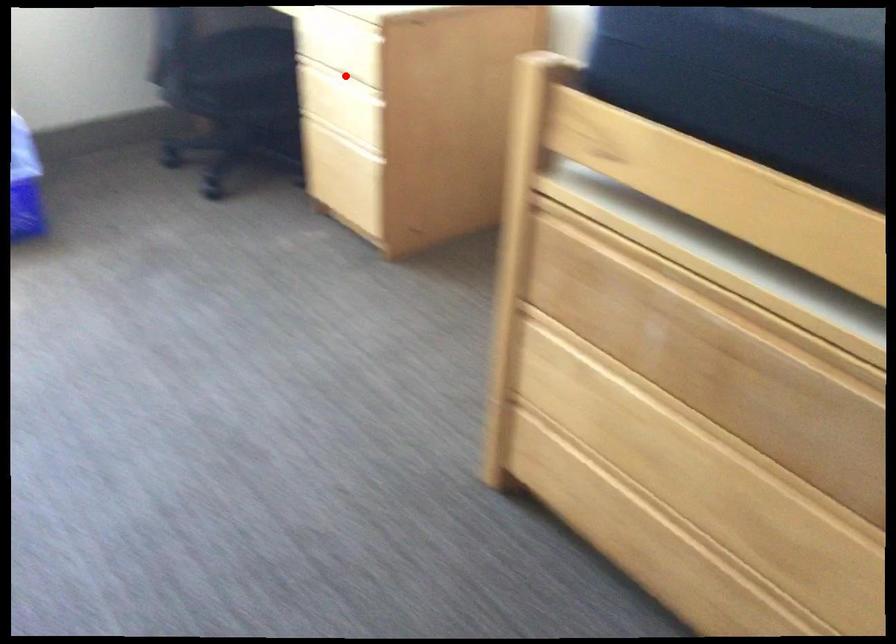
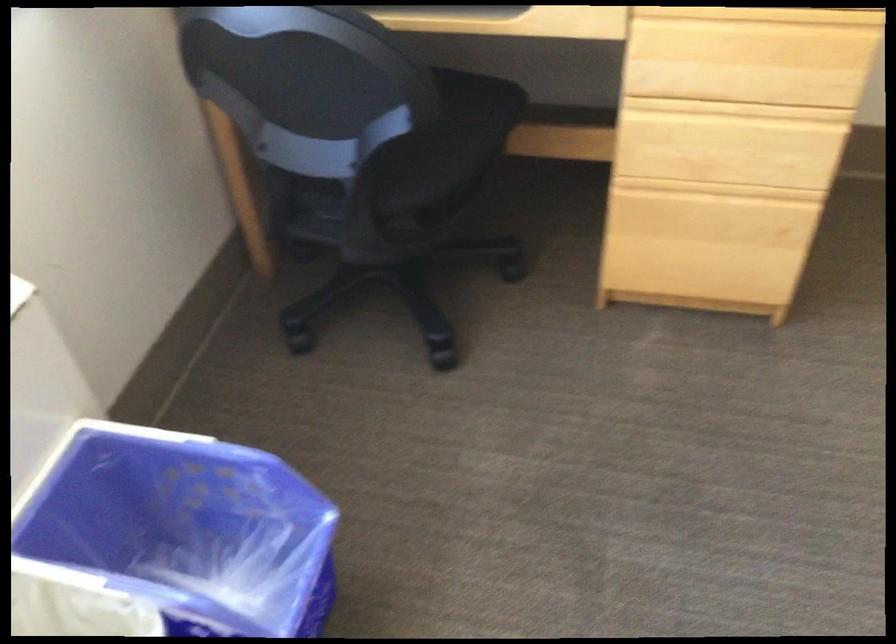
Locate, in the second image, the point that corresponds to the highlighted location in the first image.

(736, 109)